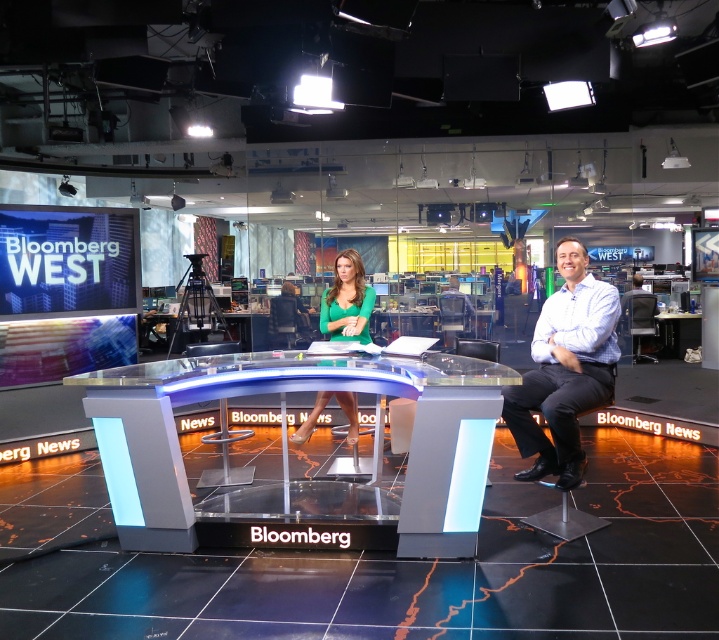
Does white shirt at right have a smaller size compared to gray fabric chair at right?

Indeed, white shirt at right has a smaller size compared to gray fabric chair at right.

Is point (610, 378) positioned before point (649, 296)?

Yes, point (610, 378) is in front of point (649, 296).

This screenshot has width=719, height=640. I want to click on white shirt at right, so click(x=564, y=369).

Which is below, white shirt at right or green matte dress at center?

white shirt at right

What do you see at coordinates (564, 369) in the screenshot? I see `white shirt at right` at bounding box center [564, 369].

Locate an element on the screen. white shirt at right is located at coordinates (564, 369).

Who is taller, green matte dress at center or gray fabric chair at right?

With more height is gray fabric chair at right.

Can you confirm if green matte dress at center is taller than gray fabric chair at right?

Incorrect, green matte dress at center's height is not larger of gray fabric chair at right's.

The height and width of the screenshot is (640, 719). Identify the location of green matte dress at center. (347, 300).